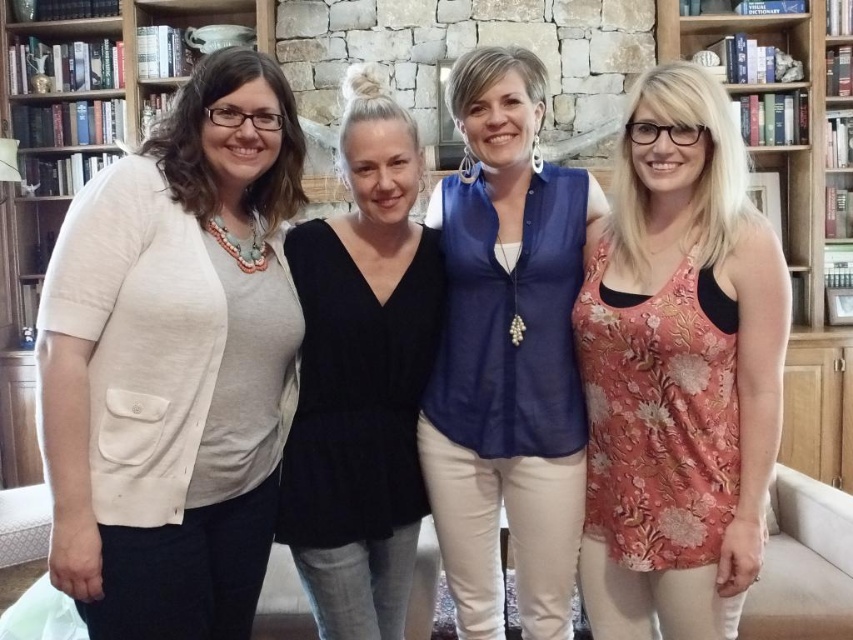
Does matte beige cardigan at left appear on the right side of wooden bookshelf at right?

In fact, matte beige cardigan at left is to the left of wooden bookshelf at right.

Which is behind, point (106, 304) or point (787, 376)?

Positioned behind is point (787, 376).

Between point (55, 488) and point (807, 218), which one is positioned behind?

The point (807, 218) is more distant.

You are a GUI agent. You are given a task and a screenshot of the screen. Output one action in this format:
    pyautogui.click(x=<x>, y=<y>)
    Task: Click on the matte beige cardigan at left
    The image size is (853, 640).
    Given the screenshot: What is the action you would take?
    pyautogui.click(x=173, y=362)

Is the position of floral fabric tank top at right less distant than that of blue sheer blouse at center?

Yes.

Where is `floral fabric tank top at right`? Image resolution: width=853 pixels, height=640 pixels. floral fabric tank top at right is located at coordinates (677, 371).

The height and width of the screenshot is (640, 853). Find the location of `floral fabric tank top at right`. floral fabric tank top at right is located at coordinates (677, 371).

Is point (581, 346) less distant than point (318, 356)?

Yes, point (581, 346) is in front of point (318, 356).

Between floral fabric tank top at right and black jersey top at center, which one has more height?

black jersey top at center is taller.

Identify the location of floral fabric tank top at right. (677, 371).

I want to click on floral fabric tank top at right, so click(677, 371).